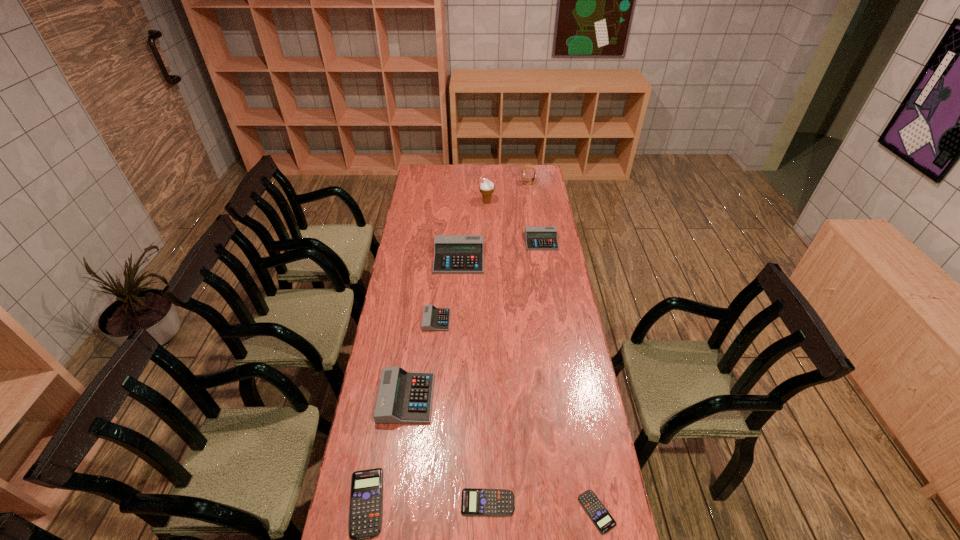
Locate an element on the screen. The height and width of the screenshot is (540, 960). white icecream is located at coordinates (486, 187).

The width and height of the screenshot is (960, 540). Identify the location of the tallest object. (486, 187).

The height and width of the screenshot is (540, 960). In order to click on the farthest object in this screenshot , I will do `click(525, 167)`.

I want to click on watch, so click(525, 167).

Locate an element on the screen. The image size is (960, 540). the tallest calculator is located at coordinates click(x=453, y=254).

Find the location of a particular element. The image size is (960, 540). the third tallest object is located at coordinates pyautogui.click(x=453, y=254).

Locate an element on the screen. Image resolution: width=960 pixels, height=540 pixels. the nearest gray calculator is located at coordinates (403, 397).

In order to click on the second tallest calculator in this screenshot , I will do point(403,397).

Locate an element on the screen. The height and width of the screenshot is (540, 960). the rightmost gray calculator is located at coordinates (537, 237).

Locate an element on the screen. The width and height of the screenshot is (960, 540). the third biggest gray calculator is located at coordinates (537, 237).